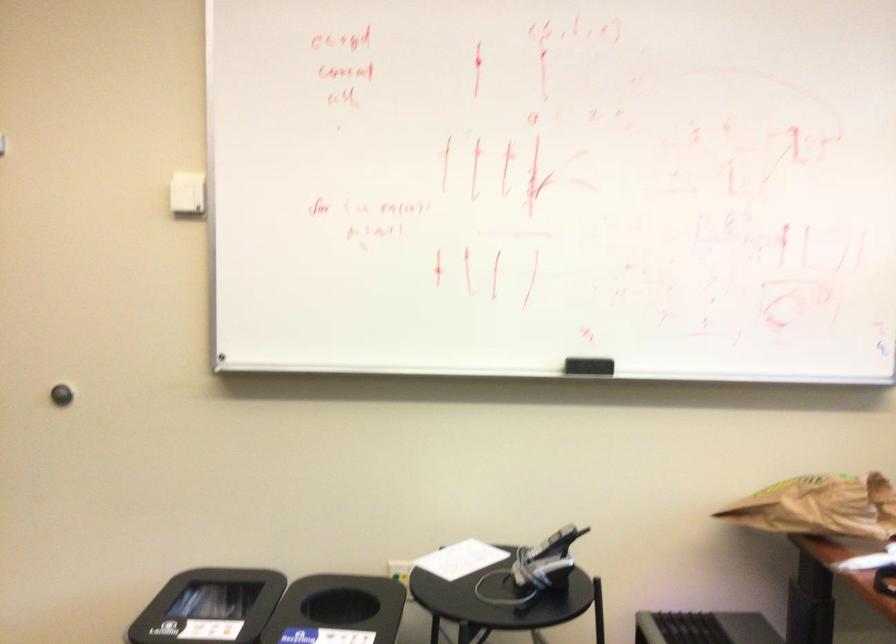
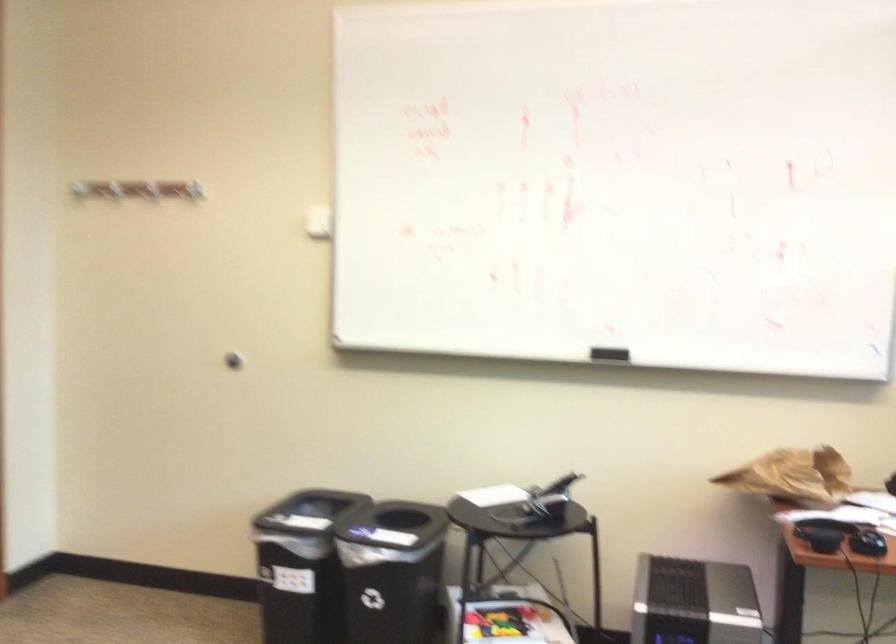
In a continuous first-person perspective shot, in which direction is the camera moving?

The cameraman moved toward right, backward.